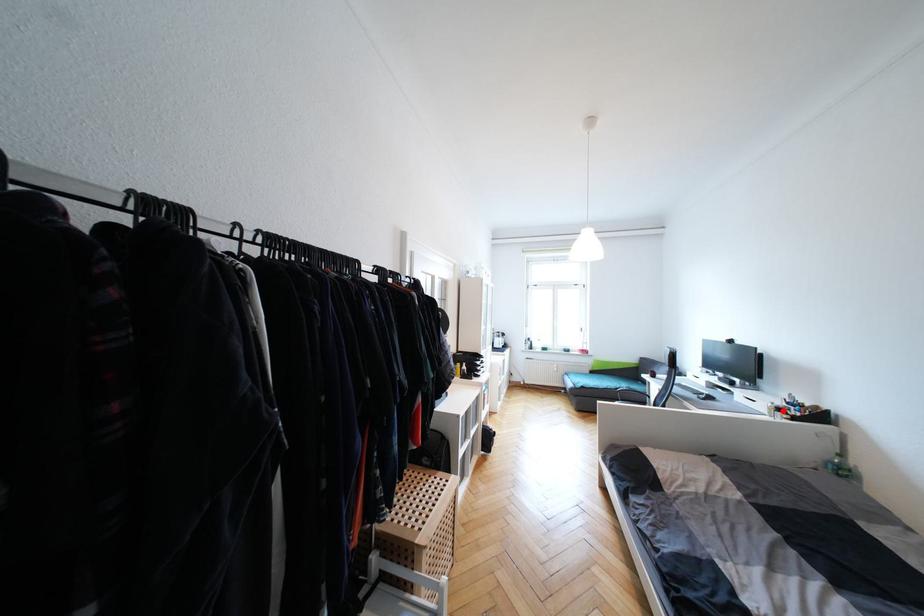
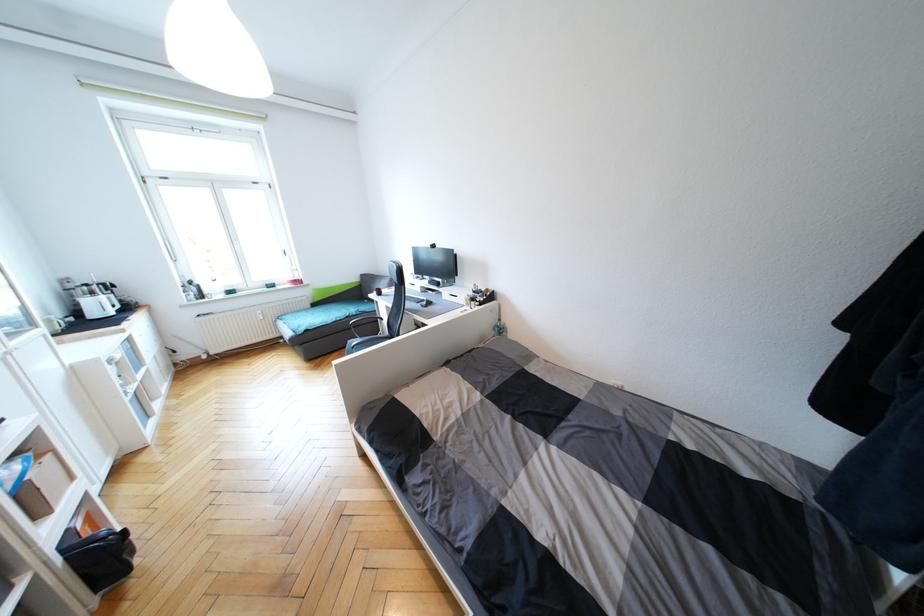
Question: I am providing you with two images of the same scene from different viewpoints. A red point is marked on the first image. At the location where the point appears in image 1, is it still visible in image 2?

Choices:
 (A) Yes
 (B) No

Answer: (A)